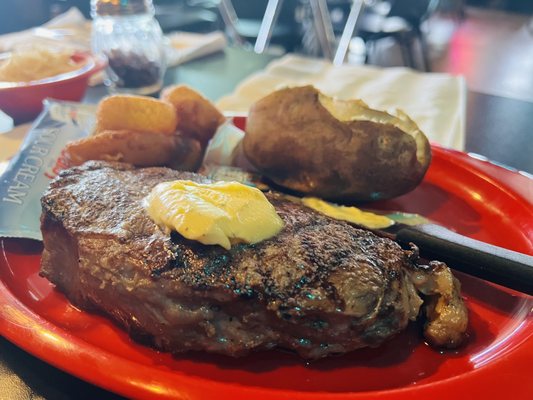
The width and height of the screenshot is (533, 400). Find the location of `red plate`. red plate is located at coordinates (101, 335).